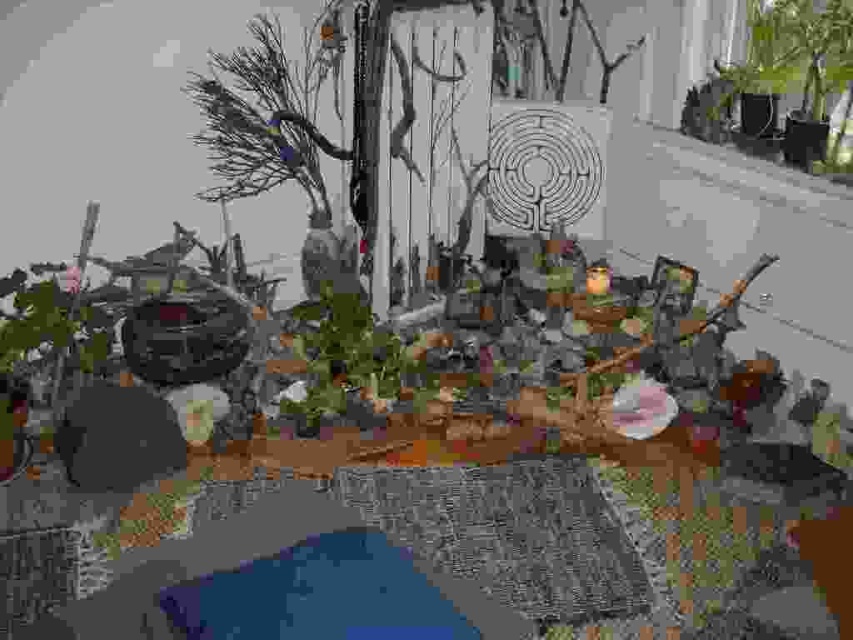
You are a photographer standing 2 meters away from the camera position. You want to capture the brown matte branch at upper left in your shot. Is the branch within your reach to adjust its position?

The brown matte branch at upper left is 1.74 meters from the camera, so since you are standing 2 meters away from the camera position, the branch is within your reach to adjust its position.

You are a gardener trying to determine if the green leafy plant at center will fit on the white concrete window sill at upper right. Based on their heights, can it be placed there?

The green leafy plant at center is shorter than the white concrete window sill at upper right, so it can be placed there as it won